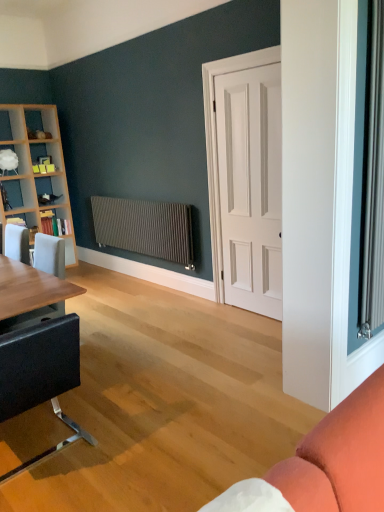
Where is `free space above white matte door at center (from a real-world perspective)`? free space above white matte door at center (from a real-world perspective) is located at coordinates (252, 67).